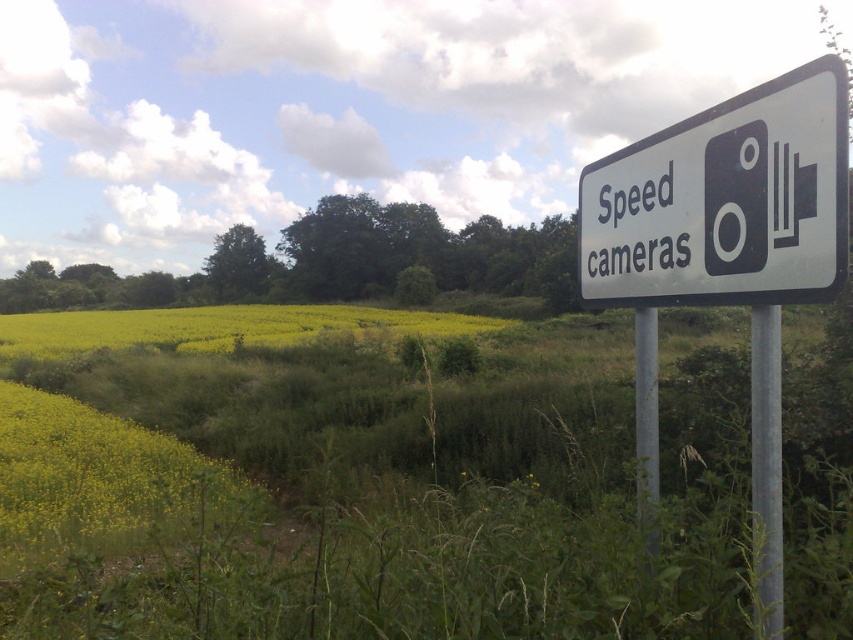
Does yellow grass at lower left appear on the left side of metallic pole at right?

Correct, you'll find yellow grass at lower left to the left of metallic pole at right.

This screenshot has width=853, height=640. In order to click on yellow grass at lower left in this screenshot , I will do `click(88, 477)`.

Between yellow grass at lower left and silver metallic pole at right, which one appears on the left side from the viewer's perspective?

Positioned to the left is yellow grass at lower left.

Which of these two, yellow grass at lower left or silver metallic pole at right, stands taller?

yellow grass at lower left is taller.

Identify the location of yellow grass at lower left. Image resolution: width=853 pixels, height=640 pixels. (88, 477).

Where is `yellow grass at lower left`? The height and width of the screenshot is (640, 853). yellow grass at lower left is located at coordinates (88, 477).

Who is lower down, white plastic sign at upper right or yellow grass at lower left?

yellow grass at lower left is lower down.

Describe the element at coordinates (730, 243) in the screenshot. I see `white plastic sign at upper right` at that location.

This screenshot has width=853, height=640. I want to click on white plastic sign at upper right, so click(x=730, y=243).